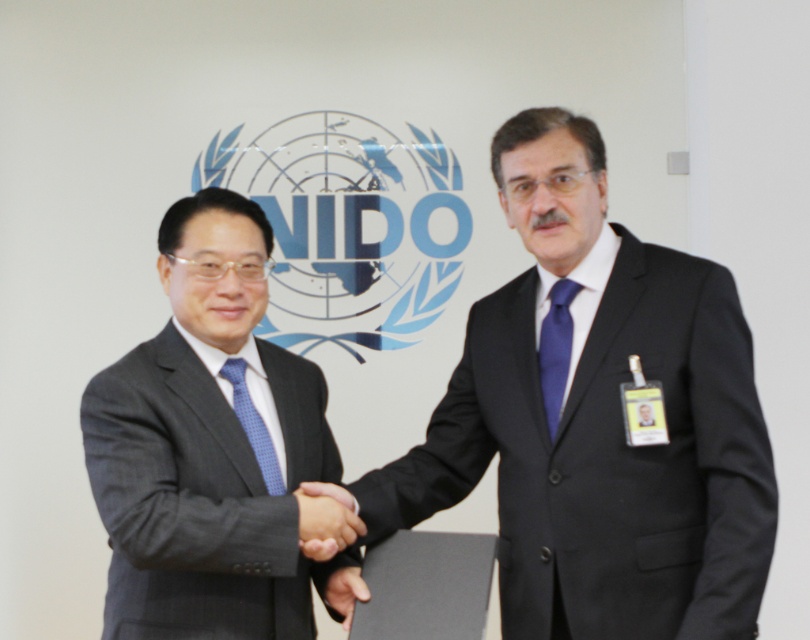
Looking at this image, can you confirm if matte blue tie at right is positioned to the right of black leather hand at center?

Indeed, matte blue tie at right is positioned on the right side of black leather hand at center.

I want to click on matte blue tie at right, so click(555, 348).

Based on the photo, measure the distance between matte blue tie at right and camera.

matte blue tie at right and camera are 5.97 feet apart from each other.

The height and width of the screenshot is (640, 810). In order to click on matte blue tie at right in this screenshot , I will do 555,348.

Which is more to the left, matte black hand at center or matte blue tie at right?

matte black hand at center

Between matte black hand at center and matte blue tie at right, which one is positioned higher?

matte blue tie at right is above.

Where is `matte black hand at center`? matte black hand at center is located at coordinates (325, 518).

Consider the image. Can you confirm if matte black suit at left is bigger than blue dotted tie at center?

Indeed, matte black suit at left has a larger size compared to blue dotted tie at center.

Is point (105, 396) positioned after point (258, 458)?

No.

Is point (313, 368) closer to viewer compared to point (271, 438)?

No, it is behind (271, 438).

The image size is (810, 640). In order to click on matte black suit at left in this screenshot , I will do `click(207, 449)`.